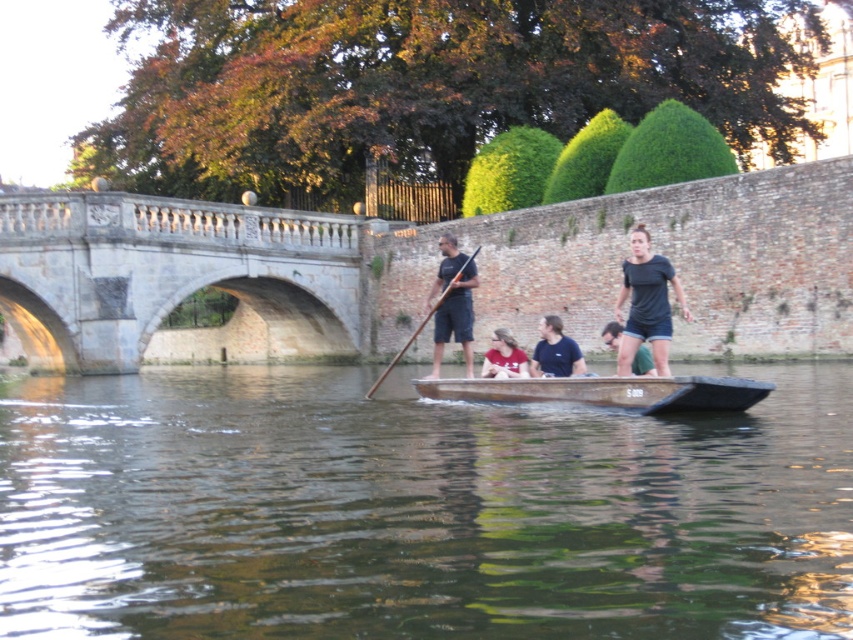
You are a photographer trying to capture the scene of the punt on the river. You notice the matte red shirt at center and the brown wooden paddle at center. Which object should you focus on first if you want to ensure both are in the frame without moving the camera?

The matte red shirt at center is located above the brown wooden paddle at center, so focusing on the matte red shirt at center first will ensure the brown wooden paddle at center remains in the frame below it without needing to adjust the camera.

You are a photographer trying to capture a clear shot of the matte red shirt at center and the brown wooden paddle at center. Based on their sizes in the image, which object would you need to zoom in more on to ensure it fills the frame adequately?

The matte red shirt at center occupies less space than the brown wooden paddle at center, so you would need to zoom in more on the matte red shirt at center to ensure it fills the frame adequately.